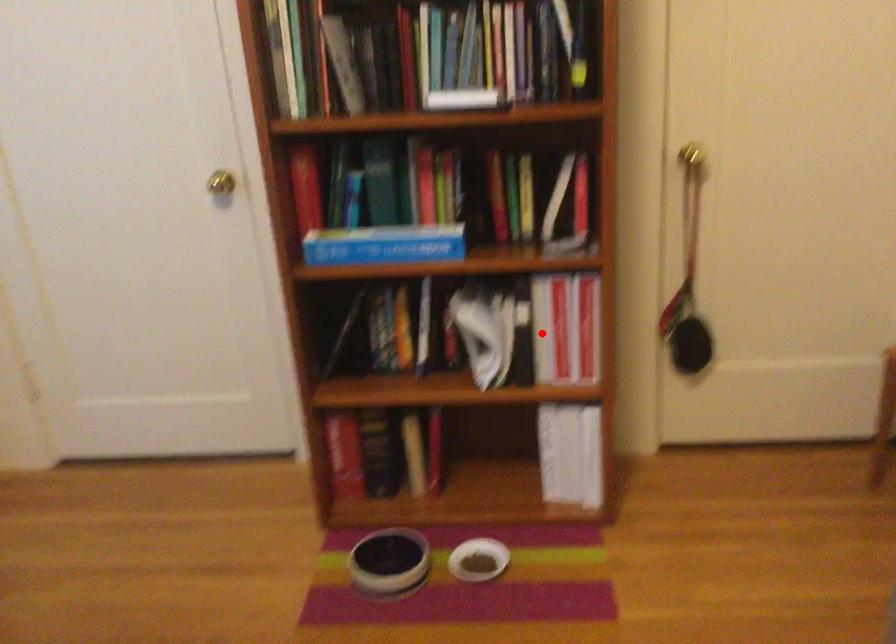
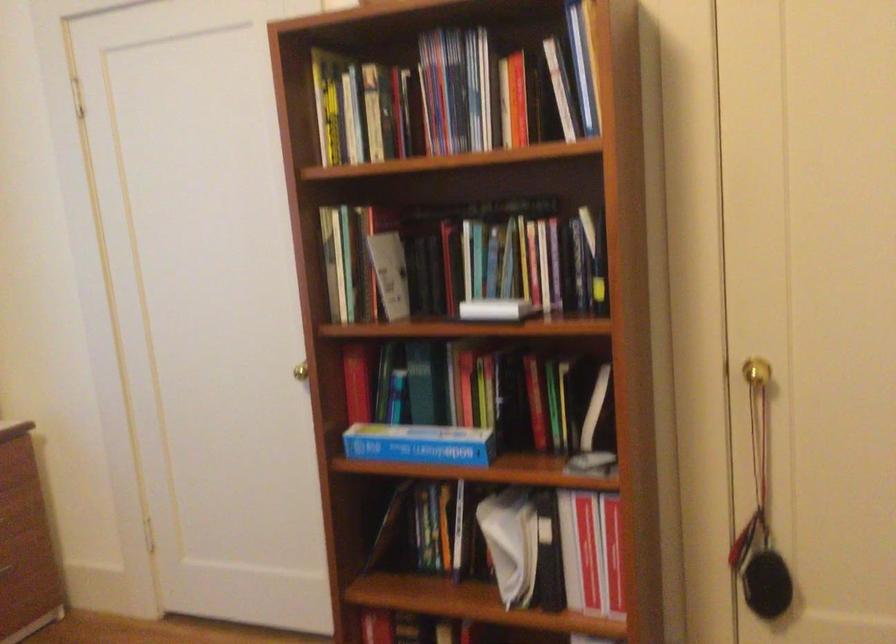
Find the pixel in the second image that matches the highlighted location in the first image.

(570, 552)